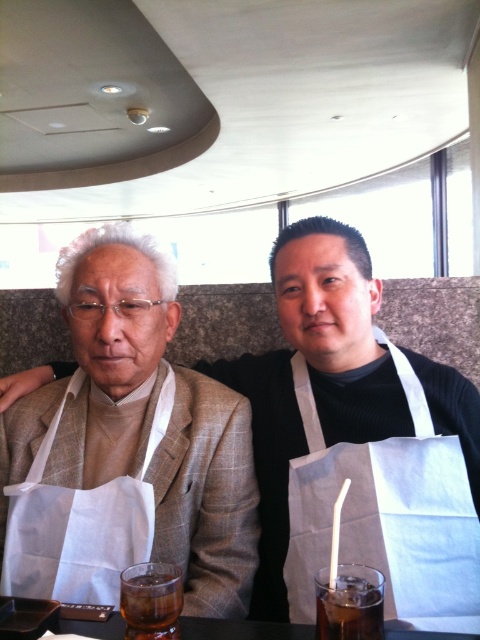
Does white fabric paper bag at center come behind dark brown glass at lower center?

Yes, it is.

Who is shorter, white fabric paper bag at center or dark brown glass at lower center?

dark brown glass at lower center

Is point (359, 531) behind point (321, 573)?

Yes.

You are a GUI agent. You are given a task and a screenshot of the screen. Output one action in this format:
    pyautogui.click(x=<x>, y=<y>)
    Task: Click on the white fabric paper bag at center
    Image resolution: width=480 pixels, height=640 pixels.
    Given the screenshot: What is the action you would take?
    pyautogui.click(x=386, y=513)

Does white textured apron at left appear on the right side of white fabric paper bag at center?

In fact, white textured apron at left is to the left of white fabric paper bag at center.

Who is more forward, (140,552) or (462,472)?

Point (140,552) is more forward.

Is point (145, 369) farther from viewer compared to point (288, 481)?

No, (145, 369) is in front of (288, 481).

The height and width of the screenshot is (640, 480). I want to click on white textured apron at left, so click(143, 422).

Is point (122, 474) behind point (342, 632)?

That is True.

Who is more distant from viewer, (104, 362) or (339, 636)?

Positioned behind is point (104, 362).

Is point (27, 422) less distant than point (357, 614)?

No, (27, 422) is further to viewer.

The width and height of the screenshot is (480, 640). Find the location of `white textured apron at left`. white textured apron at left is located at coordinates (143, 422).